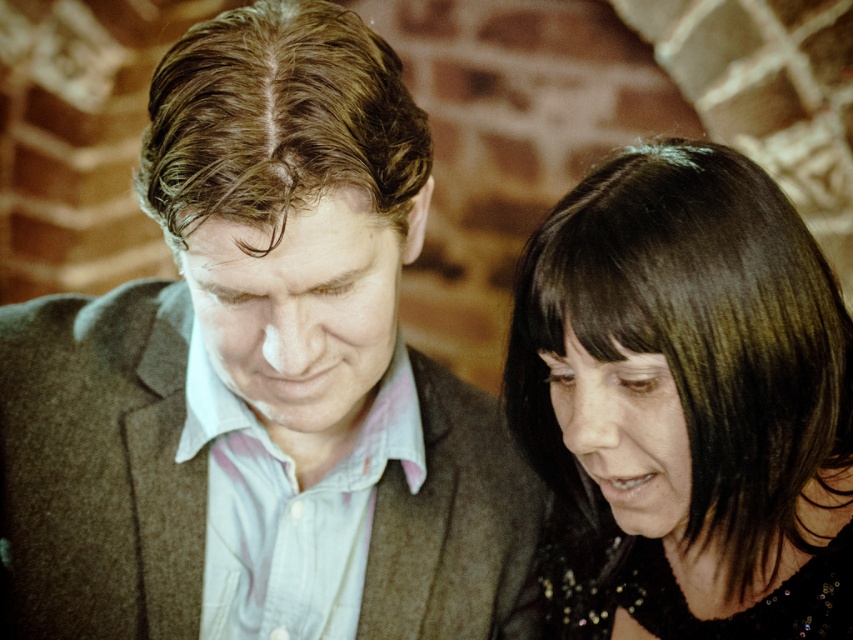
Who is higher up, brown woolen suit at center or shiny black hair at center?

brown woolen suit at center is higher up.

Which is behind, point (395, 364) or point (540, 316)?

Point (395, 364)

Describe the element at coordinates (260, 371) in the screenshot. I see `brown woolen suit at center` at that location.

Where is `brown woolen suit at center`? brown woolen suit at center is located at coordinates (260, 371).